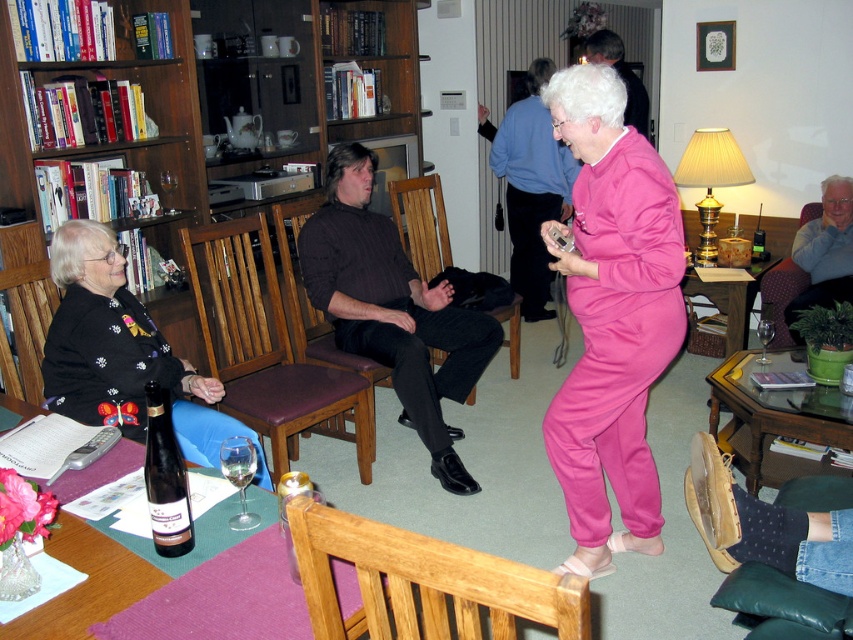
Based on the photo, you are standing in the living room and want to place a small plant on the wooden bookshelf at upper left. The plant needs to be placed at the exact point with coordinates point (123, 140). Is this possible?

Yes, the point (123, 140) is on the wooden bookshelf at upper left, so placing the plant there is possible.

You are standing in the living room and want to reach the point at coordinates point [55,330]. If your walking speed is 3 feet per second, how many seconds will it take you to reach that point?

The distance between you and point [55,330] is 7.88 feet. At a speed of 3 feet per second, it would take approximately 2.63 seconds to reach the point.

Consider the image. You are standing at the entrance of the living room and want to greet the people sitting at the dining table. Which of the two points, point (583, 332) or point (560, 627), is closer to you?

Point (560, 627) is closer to you because it is in front of point (583, 332).